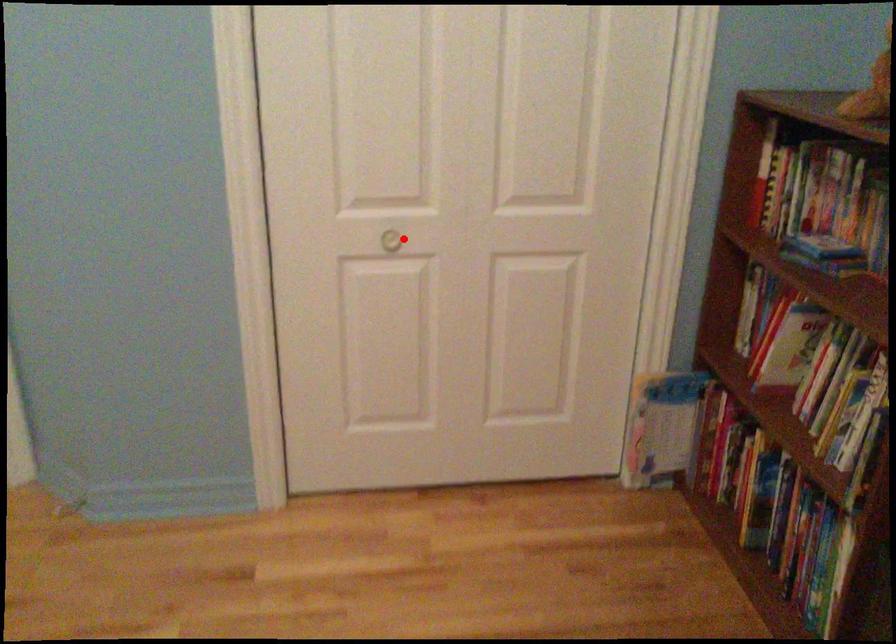
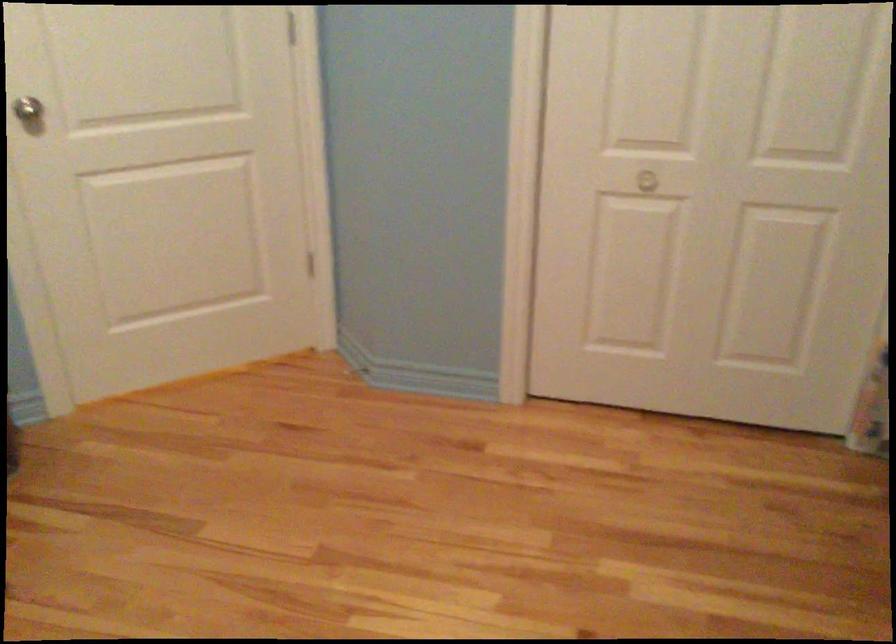
Where in the second image is the point corresponding to the highlighted location from the first image?

(658, 176)